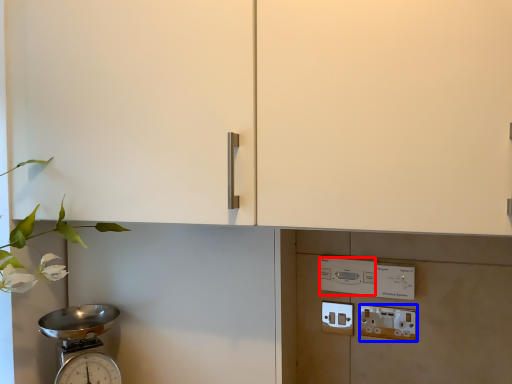
Question: Which object appears farthest to the camera in this image, light switch (highlighted by a red box) or electric outlet (highlighted by a blue box)?

Choices:
 (A) light switch
 (B) electric outlet

Answer: (A)